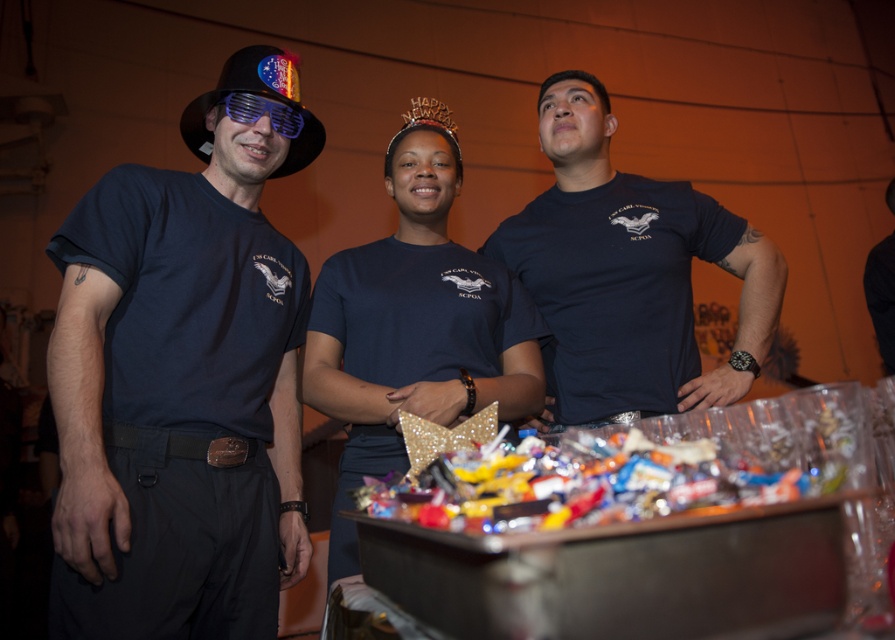
Does point (572, 321) come closer to viewer compared to point (704, 448)?

No.

What do you see at coordinates (628, 272) in the screenshot?
I see `dark blue t-shirt at center` at bounding box center [628, 272].

Identify the location of dark blue t-shirt at center. (628, 272).

Is matte black t-shirt at left smaller than black fabric party hat at upper left?

Incorrect, matte black t-shirt at left is not smaller in size than black fabric party hat at upper left.

Does matte black t-shirt at left have a lesser width compared to black fabric party hat at upper left?

No, matte black t-shirt at left is not thinner than black fabric party hat at upper left.

You are a GUI agent. You are given a task and a screenshot of the screen. Output one action in this format:
    pyautogui.click(x=<x>, y=<y>)
    Task: Click on the matte black t-shirt at left
    
    Given the screenshot: What is the action you would take?
    pyautogui.click(x=183, y=378)

Identify the location of matte black t-shirt at left. This screenshot has height=640, width=895. (183, 378).

Between matte black t-shirt at left and glossy plastic tray at center, which one appears on the left side from the viewer's perspective?

matte black t-shirt at left is more to the left.

Is point (262, 84) more distant than point (871, 467)?

Yes.

Where is `matte black t-shirt at left`? Image resolution: width=895 pixels, height=640 pixels. matte black t-shirt at left is located at coordinates (183, 378).

Where is `matte black t-shirt at left`? The image size is (895, 640). matte black t-shirt at left is located at coordinates (183, 378).